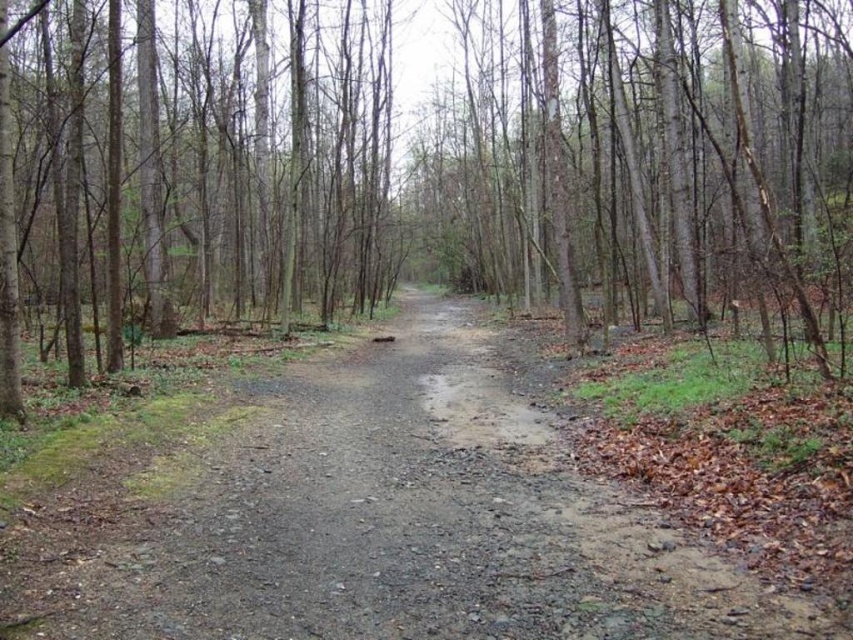
You are a hiker standing at the starting point of the dirt path in the forest. You notice a point marked at coordinates (422, 168). What object does this point indicate?

The point marked at coordinates (422, 168) indicates a brown bark tree at center.

You are a hiker planning to walk along the gray gravel path at center. You notice a brown bark tree at center in your path. Will the tree block your way on the path?

The brown bark tree at center is above the gray gravel path at center, so it will not block the path itself. You can walk under it or around the base if needed.

You are a hiker walking along the gray gravel path at center. You want to take a photo of the brown bark tree at center. Which direction should you move to get the tree in your camera frame?

The brown bark tree at center is positioned on the left side of gray gravel path at center, so you should move to the left side of the path to get the tree in your camera frame.